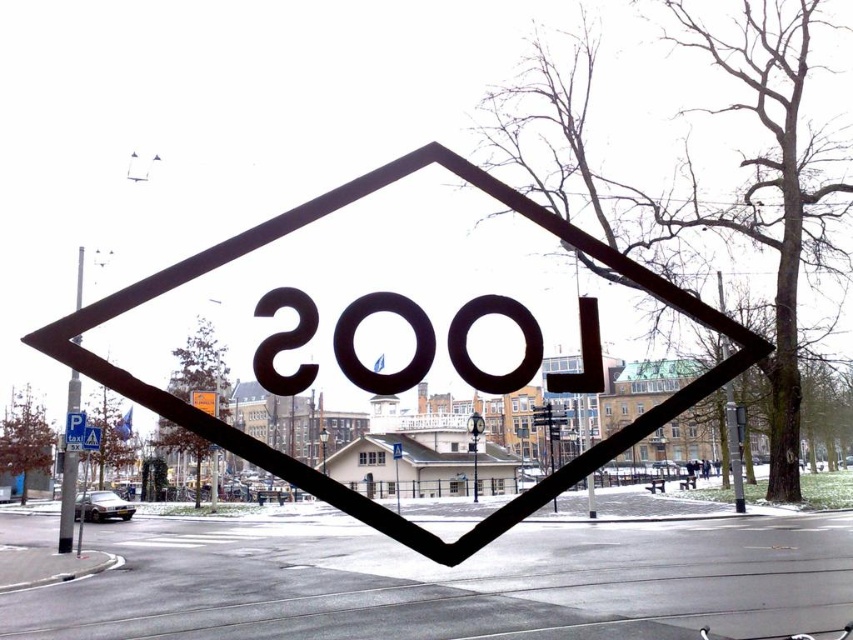
Is black metal sign at center shorter than black matte sign at center?

Yes, black metal sign at center is shorter than black matte sign at center.

Describe the element at coordinates (74, 422) in the screenshot. I see `black metal sign at center` at that location.

Identify the location of black metal sign at center. (74, 422).

Is the position of metallic pole at left more distant than that of black metal sign at center?

No, it is in front of black metal sign at center.

Who is taller, metallic pole at left or black metal sign at center?

With more height is metallic pole at left.

Does point (68, 476) come farther from viewer compared to point (82, 422)?

Yes, it is.

The width and height of the screenshot is (853, 640). I want to click on metallic pole at left, so click(x=67, y=499).

Is metallic sign at center below black matte sign at center?

Actually, metallic sign at center is above black matte sign at center.

Does point (416, 540) lie in front of point (85, 433)?

Yes, point (416, 540) is in front of point (85, 433).

Between point (268, 451) and point (85, 428), which one is positioned behind?

The point (85, 428) is behind.

What are the coordinates of `metallic sign at center` in the screenshot? It's located at (335, 481).